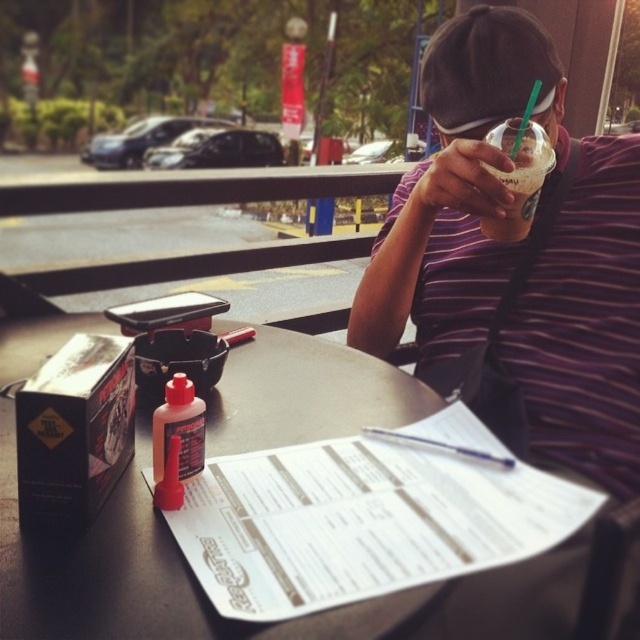
Between purple striped shirt at upper right and smooth black table at center, which one is positioned lower?

smooth black table at center

Can you confirm if purple striped shirt at upper right is bigger than smooth black table at center?

No.

Between point (484, 275) and point (426, 616), which one is positioned behind?

Point (484, 275)

Locate an element on the screen. purple striped shirt at upper right is located at coordinates pyautogui.click(x=458, y=188).

The image size is (640, 640). Describe the element at coordinates (458, 188) in the screenshot. I see `purple striped shirt at upper right` at that location.

Who is taller, purple striped shirt at upper right or translucent plastic cup at upper right?

With more height is purple striped shirt at upper right.

Locate an element on the screen. This screenshot has height=640, width=640. purple striped shirt at upper right is located at coordinates (x=458, y=188).

Who is taller, smooth black table at center or translucent plastic cup at upper right?

With more height is smooth black table at center.

How distant is smooth black table at center from translucent plastic cup at upper right?

They are 16.33 inches apart.

Does point (147, 516) come in front of point (545, 150)?

Yes, it is in front of point (545, 150).

Where is `smooth black table at center`? The width and height of the screenshot is (640, 640). smooth black table at center is located at coordinates (147, 577).